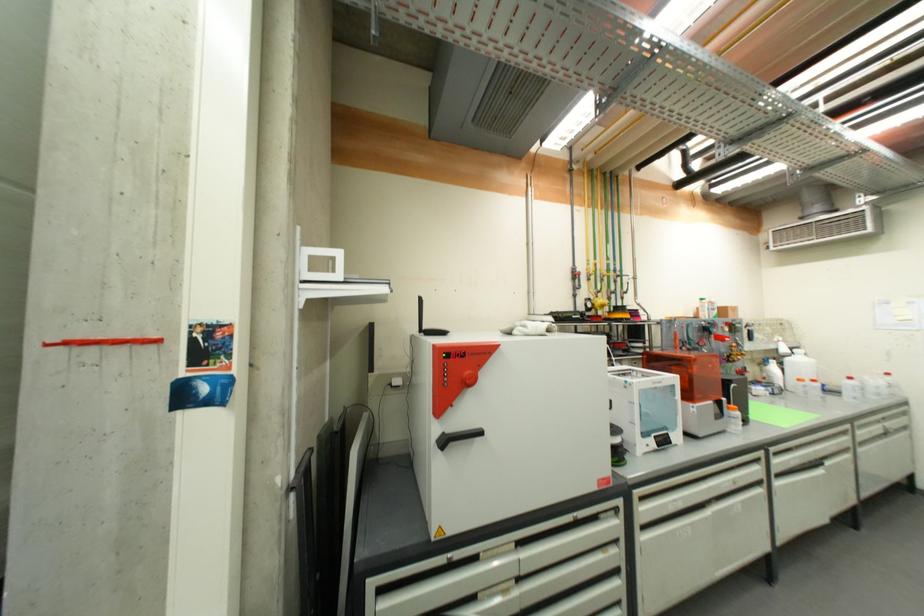
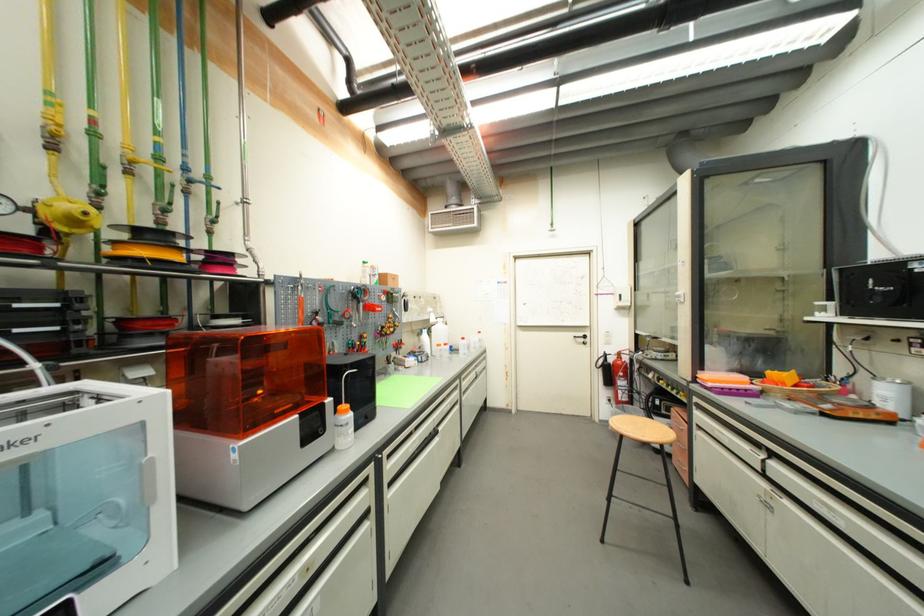
The point at (730, 400) is marked in the first image. Where is the corresponding point in the second image?

(334, 402)